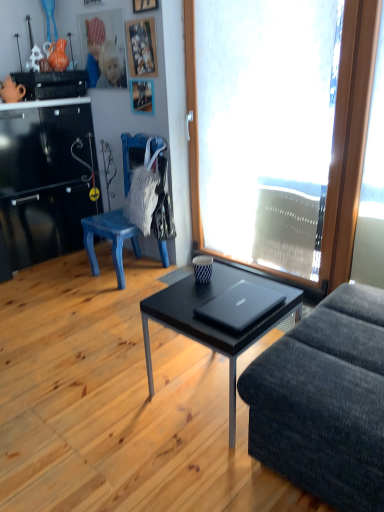
Question: Considering the relative sizes of wooden picture frame at upper center, acting as the first picture frame starting from the bottom, and wooden picture frame at upper center, which ranks as the 2th picture frame in bottom-to-top order, in the image provided, is wooden picture frame at upper center, acting as the first picture frame starting from the bottom, taller than wooden picture frame at upper center, which ranks as the 2th picture frame in bottom-to-top order,?

Choices:
 (A) no
 (B) yes

Answer: (A)

Question: Is the position of wooden picture frame at upper center, marked as the 3th picture frame in a top-to-bottom arrangement, less distant than that of wooden picture frame at upper center, which ranks as the 2th picture frame in bottom-to-top order?

Choices:
 (A) yes
 (B) no

Answer: (B)

Question: Does wooden picture frame at upper center, acting as the first picture frame starting from the bottom, have a lesser height compared to wooden picture frame at upper center, the second picture frame in the top-to-bottom sequence?

Choices:
 (A) yes
 (B) no

Answer: (A)

Question: Is wooden picture frame at upper center, marked as the 3th picture frame in a top-to-bottom arrangement, facing away from wooden picture frame at upper center, which ranks as the 2th picture frame in bottom-to-top order?

Choices:
 (A) no
 (B) yes

Answer: (A)

Question: Does wooden picture frame at upper center, acting as the first picture frame starting from the bottom, have a larger size compared to wooden picture frame at upper center, which ranks as the 2th picture frame in bottom-to-top order?

Choices:
 (A) yes
 (B) no

Answer: (B)

Question: From a real-world perspective, is wooden picture frame at upper center, acting as the first picture frame starting from the bottom, beneath wooden picture frame at upper center, which ranks as the 2th picture frame in bottom-to-top order?

Choices:
 (A) no
 (B) yes

Answer: (B)

Question: Is wooden picture frame at upper center, the 3th picture frame positioned from the bottom, bigger than wooden picture frame at upper center, acting as the first picture frame starting from the bottom?

Choices:
 (A) no
 (B) yes

Answer: (A)

Question: Considering the relative sizes of wooden picture frame at upper center, acting as the first picture frame starting from the top, and wooden picture frame at upper center, marked as the 3th picture frame in a top-to-bottom arrangement, in the image provided, is wooden picture frame at upper center, acting as the first picture frame starting from the top, taller than wooden picture frame at upper center, marked as the 3th picture frame in a top-to-bottom arrangement,?

Choices:
 (A) yes
 (B) no

Answer: (A)

Question: Is wooden picture frame at upper center, the 3th picture frame positioned from the bottom, looking in the opposite direction of wooden picture frame at upper center, acting as the first picture frame starting from the bottom?

Choices:
 (A) yes
 (B) no

Answer: (B)

Question: From a real-world perspective, is wooden picture frame at upper center, acting as the first picture frame starting from the top, physically above wooden picture frame at upper center, acting as the first picture frame starting from the bottom?

Choices:
 (A) yes
 (B) no

Answer: (A)

Question: Is wooden picture frame at upper center, the 3th picture frame positioned from the bottom, located outside wooden picture frame at upper center, marked as the 3th picture frame in a top-to-bottom arrangement?

Choices:
 (A) yes
 (B) no

Answer: (A)

Question: Could you tell me if wooden picture frame at upper center, the 3th picture frame positioned from the bottom, is facing wooden picture frame at upper center, acting as the first picture frame starting from the bottom?

Choices:
 (A) yes
 (B) no

Answer: (B)

Question: From a real-world perspective, is black matte coffee table at center physically above wooden picture frame at upper center, the second picture frame in the top-to-bottom sequence?

Choices:
 (A) no
 (B) yes

Answer: (A)